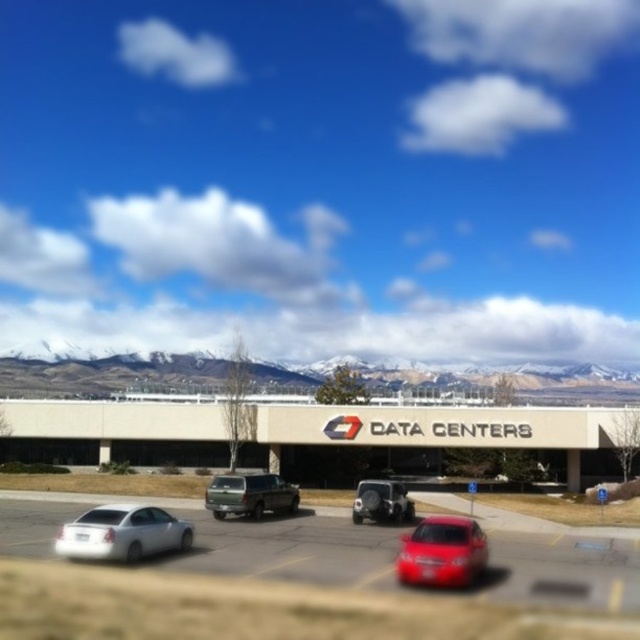
Question: Which of these objects is positioned closest to the green matte suv at center?

Choices:
 (A) white matte sedan at lower left
 (B) snow-covered mountains at upper center
 (C) glossy red sedan at center
 (D) beige concrete building at center

Answer: (C)

Question: Can you confirm if glossy red sedan at center is bigger than green matte suv at center?

Choices:
 (A) no
 (B) yes

Answer: (A)

Question: Which of these objects is positioned farthest from the metallic silver car at center?

Choices:
 (A) snow-covered mountains at upper center
 (B) beige concrete building at center

Answer: (A)

Question: Which object is positioned farthest from the metallic silver car at center?

Choices:
 (A) beige concrete building at center
 (B) green matte suv at center
 (C) white matte sedan at lower left

Answer: (A)

Question: Can you confirm if metallic silver car at center is positioned above metallic silver suv at center?

Choices:
 (A) yes
 (B) no

Answer: (A)

Question: Is white matte sedan at lower left positioned in front of metallic silver suv at center?

Choices:
 (A) no
 (B) yes

Answer: (B)